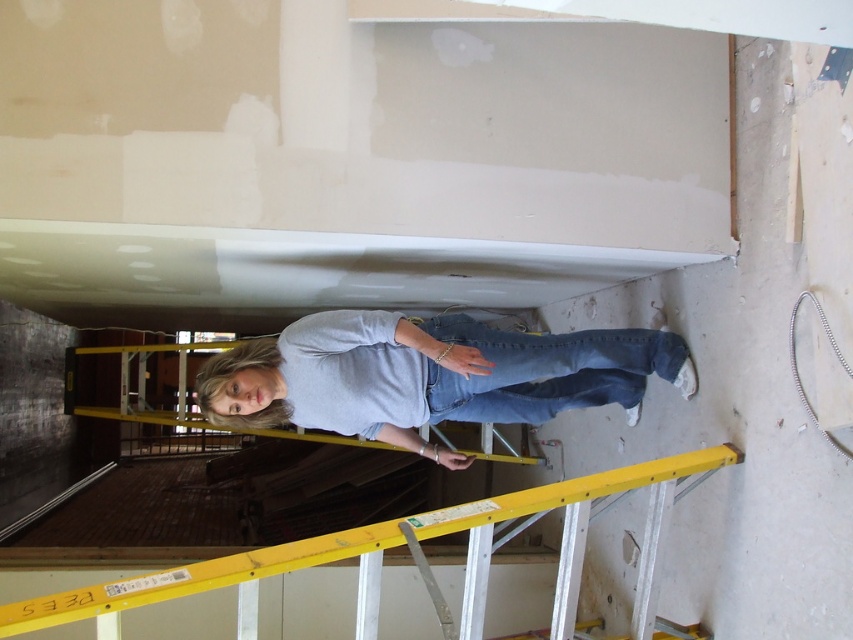
Is the position of yellow metallic ladder at center more distant than that of denim at center?

No, yellow metallic ladder at center is closer to the viewer.

Does yellow metallic ladder at center have a smaller size compared to denim at center?

Incorrect, yellow metallic ladder at center is not smaller in size than denim at center.

Locate an element on the screen. yellow metallic ladder at center is located at coordinates (398, 545).

I want to click on yellow metallic ladder at center, so click(x=398, y=545).

Does light gray cotton shirt at center have a smaller size compared to yellow metallic ladder at center?

Yes, light gray cotton shirt at center is smaller than yellow metallic ladder at center.

Can you confirm if light gray cotton shirt at center is wider than yellow metallic ladder at center?

No, light gray cotton shirt at center is not wider than yellow metallic ladder at center.

In order to click on light gray cotton shirt at center in this screenshot , I will do `click(428, 374)`.

Between light gray cotton shirt at center and denim at center, which one appears on the left side from the viewer's perspective?

Positioned to the left is light gray cotton shirt at center.

Is the position of light gray cotton shirt at center more distant than that of denim at center?

That is False.

Is point (265, 355) positioned after point (488, 417)?

No.

Identify the location of light gray cotton shirt at center. (428, 374).